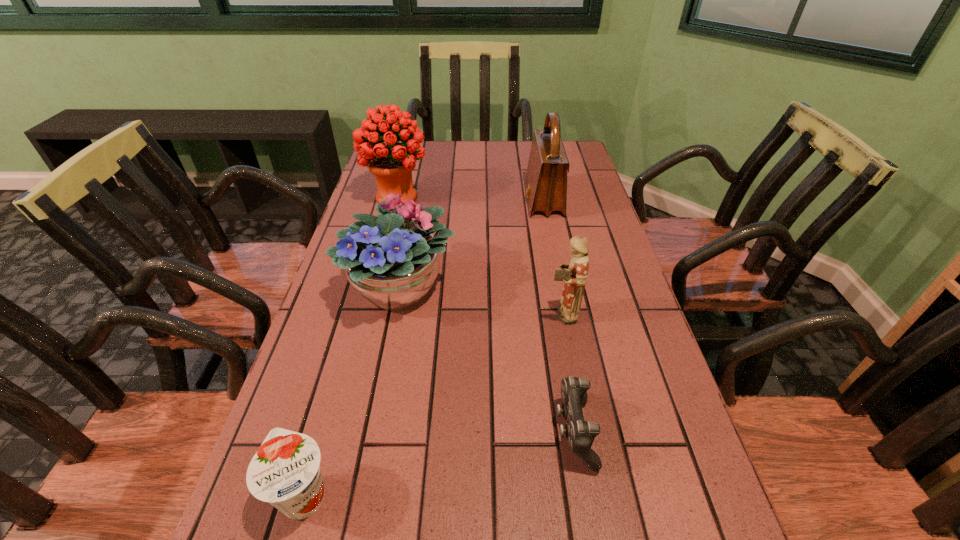
Identify the location of unoccupied area between the farther bouquet and the shoulder bag. This screenshot has width=960, height=540. (470, 199).

Where is `free space between the yogurt and the control`? Image resolution: width=960 pixels, height=540 pixels. free space between the yogurt and the control is located at coordinates (439, 463).

At what (x,y) coordinates should I click in order to perform the action: click on free space that is in between the shoulder bag and the farther bouquet. Please return your answer as a coordinate pair (x, y). Image resolution: width=960 pixels, height=540 pixels. Looking at the image, I should click on point(470,199).

What are the coordinates of `free space between the yogurt and the farther bouquet` in the screenshot? It's located at (350, 346).

Where is `object that is the fifth closest one to the shorter bouquet`? This screenshot has height=540, width=960. object that is the fifth closest one to the shorter bouquet is located at coordinates (285, 471).

Identify which object is located as the fourth nearest to the control. Please provide its 2D coordinates. Your answer should be formatted as a tuple, i.e. [(x, y)], where the tuple contains the x and y coordinates of a point satisfying the conditions above.

[(546, 178)]

You are a GUI agent. You are given a task and a screenshot of the screen. Output one action in this format:
    pyautogui.click(x=<x>, y=<y>)
    Task: Click on the vacant region that satisfies the following two spatial constraints: 1. on the front-facing side of the figurine; 2. on the front side of the yogurt
    The width and height of the screenshot is (960, 540).
    Given the screenshot: What is the action you would take?
    pyautogui.click(x=596, y=495)

This screenshot has height=540, width=960. In order to click on free space that satisfies the following two spatial constraints: 1. on the front flap of the shoulder bag; 2. on the front side of the yogurt in this screenshot , I will do coord(601,495).